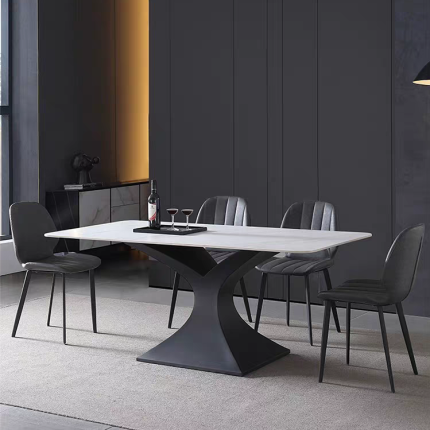
Find the location of a particular element. The height and width of the screenshot is (430, 430). window is located at coordinates (3, 150), (3, 55).